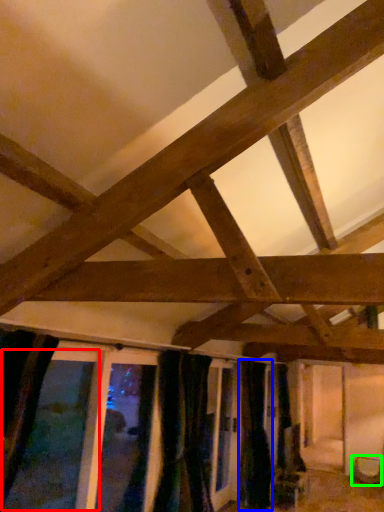
Question: Which is farther away from window (highlighted by a red box)? curtain (highlighted by a blue box) or furniture (highlighted by a green box)?

Choices:
 (A) curtain
 (B) furniture

Answer: (B)